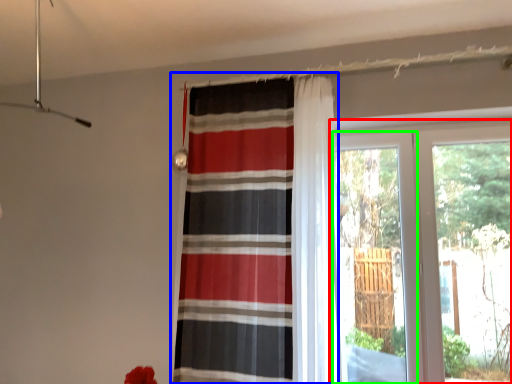
Question: Which object is positioned farthest from window (highlighted by a red box)? Select from curtain (highlighted by a blue box) and screen door (highlighted by a green box).

Choices:
 (A) curtain
 (B) screen door

Answer: (A)